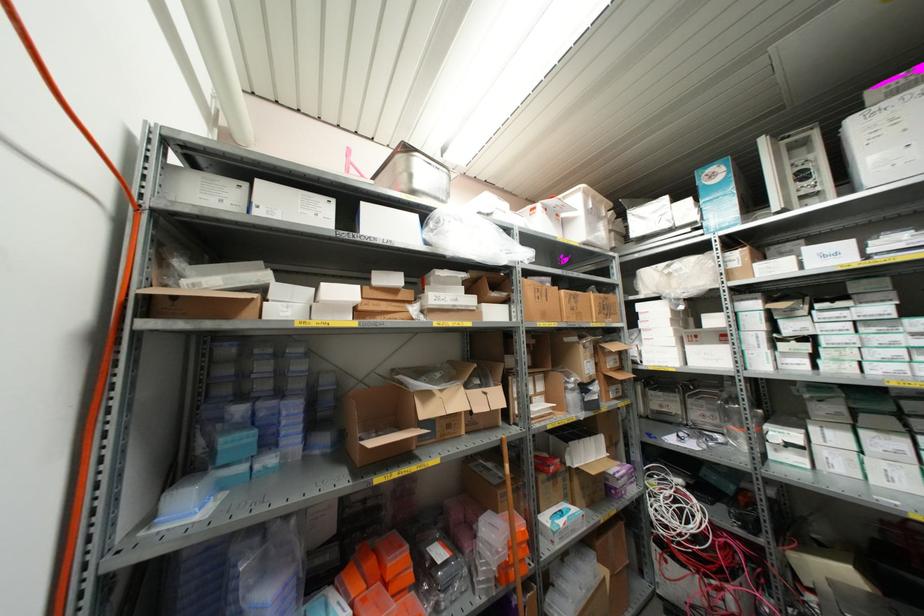
Describe the element at coordinates (415, 175) in the screenshot. I see `the shiny metal container` at that location.